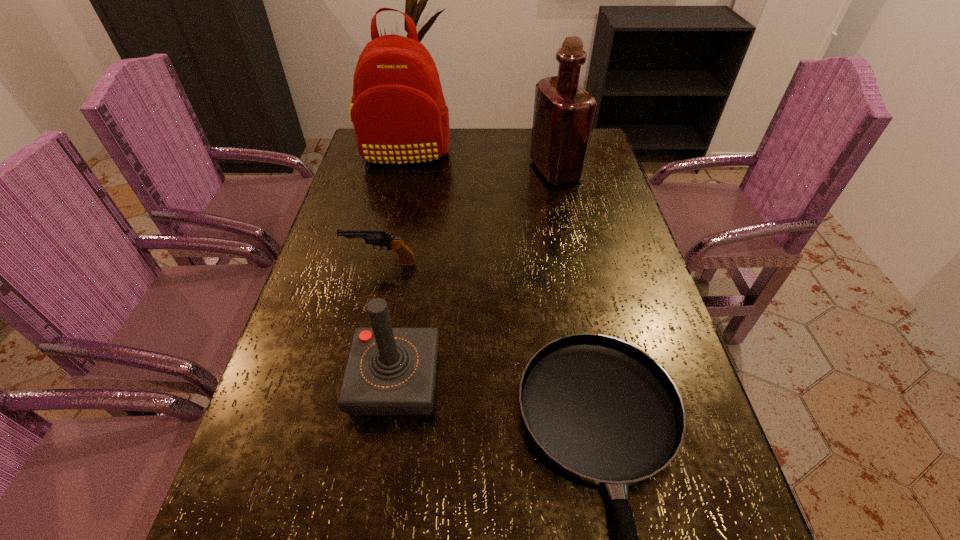
At what (x,y) coordinates should I click in order to perform the action: click on blank region between the backpack and the second shortest object. Please return your answer as a coordinate pair (x, y). This screenshot has height=540, width=960. Looking at the image, I should click on (393, 208).

This screenshot has width=960, height=540. I want to click on blank region between the backpack and the liquor, so click(x=480, y=161).

Image resolution: width=960 pixels, height=540 pixels. I want to click on free space between the backpack and the third shortest object, so click(x=399, y=266).

Where is `free spot between the liquor and the joystick`? This screenshot has width=960, height=540. free spot between the liquor and the joystick is located at coordinates (475, 275).

The height and width of the screenshot is (540, 960). Find the location of `empty space that is in between the third shortest object and the backpack`. empty space that is in between the third shortest object and the backpack is located at coordinates (399, 266).

I want to click on object that is the third closest to the third shortest object, so click(x=564, y=113).

Identify which object is located as the fourth nearest to the liquor. Please provide its 2D coordinates. Your answer should be formatted as a tuple, i.e. [(x, y)], where the tuple contains the x and y coordinates of a point satisfying the conditions above.

[(390, 371)]

Where is `vacant space that satisfies the following two spatial constraints: 1. along the barrel of the fourth tallest object; 2. on the left side of the liquor`? vacant space that satisfies the following two spatial constraints: 1. along the barrel of the fourth tallest object; 2. on the left side of the liquor is located at coordinates 401,170.

Where is `vacant area that satisfies the following two spatial constraints: 1. on the front-facing side of the backpack; 2. along the barrel of the gun`? vacant area that satisfies the following two spatial constraints: 1. on the front-facing side of the backpack; 2. along the barrel of the gun is located at coordinates (379, 263).

Locate an element on the screen. Image resolution: width=960 pixels, height=540 pixels. free space that satisfies the following two spatial constraints: 1. along the barrel of the third farthest object; 2. on the back side of the liquor is located at coordinates (401, 170).